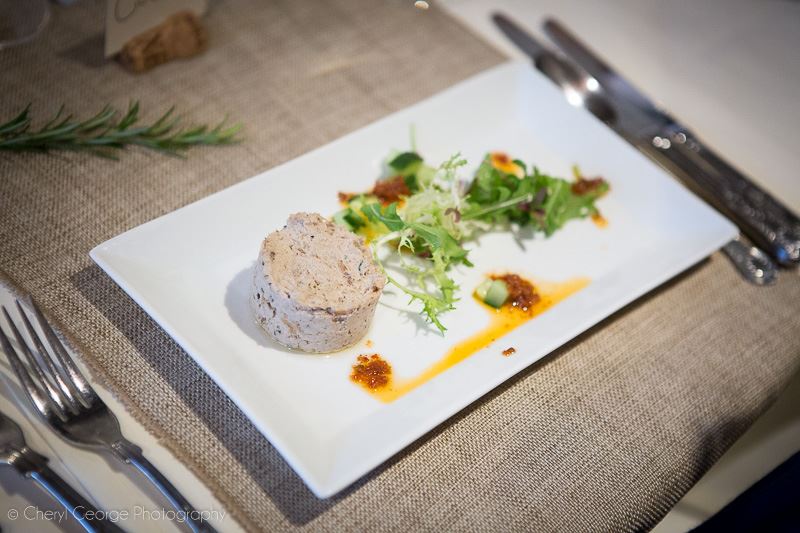
Locate an element on the screen. The height and width of the screenshot is (533, 800). silver fork tines is located at coordinates (x=20, y=367), (x=30, y=359), (x=41, y=349), (x=54, y=343).